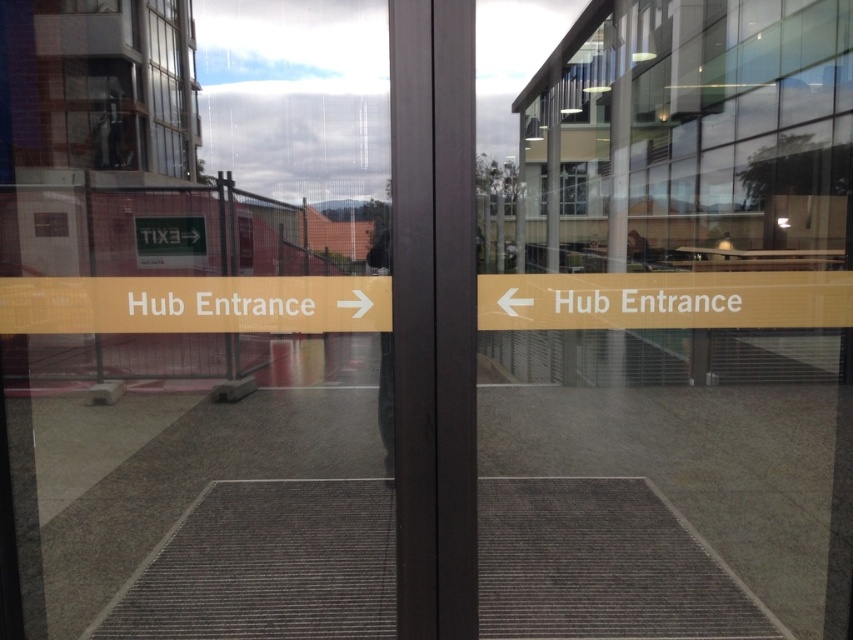
Consider the image. Between transparent glass door at center and clear glass window at upper left, which one has less height?

Standing shorter between the two is clear glass window at upper left.

Is point (816, 525) closer to viewer compared to point (172, 152)?

Yes, it is.

What are the coordinates of `transparent glass door at center` in the screenshot? It's located at (679, 321).